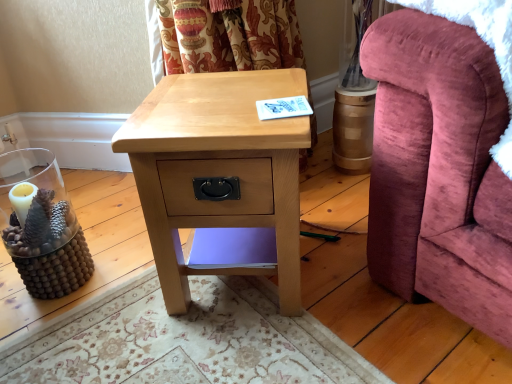
Question: In the image, is natural wood nightstand at center positioned in front of or behind velvet pink armchair at right?

Choices:
 (A) behind
 (B) front

Answer: (A)

Question: From the image's perspective, is natural wood nightstand at center above or below velvet pink armchair at right?

Choices:
 (A) above
 (B) below

Answer: (B)

Question: From a real-world perspective, relative to velvet pink armchair at right, is natural wood nightstand at center vertically above or below?

Choices:
 (A) below
 (B) above

Answer: (A)

Question: From a real-world perspective, is velvet pink armchair at right above or below natural wood nightstand at center?

Choices:
 (A) below
 (B) above

Answer: (B)

Question: Is velvet pink armchair at right wider or thinner than natural wood nightstand at center?

Choices:
 (A) wide
 (B) thin

Answer: (A)

Question: Is velvet pink armchair at right bigger or smaller than natural wood nightstand at center?

Choices:
 (A) big
 (B) small

Answer: (A)

Question: Is velvet pink armchair at right taller or shorter than natural wood nightstand at center?

Choices:
 (A) tall
 (B) short

Answer: (B)